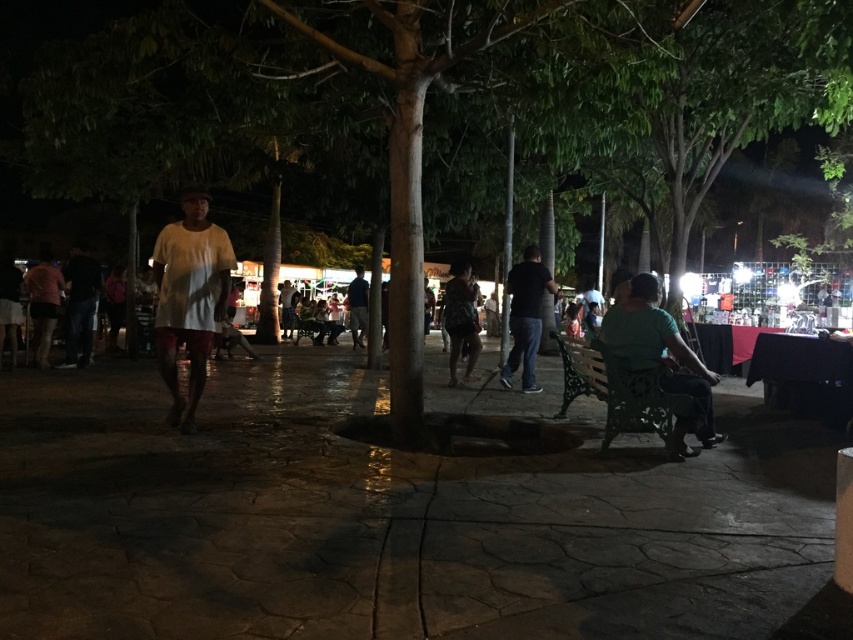
You are standing at the point marked as point (521, 365) in the image. You want to walk straight towards the nearest tree. How far will you have to walk?

The distance of point (521, 365) from viewer is 9.33 meters. Therefore, you will have to walk 9.33 meters to reach the nearest tree.

You are a photographer trying to capture the scene. You notice the white matte shirt at center and the dark blue jeans at left. Which one should you focus on if you want to capture the larger object in your shot?

The white matte shirt at center is larger in size than the dark blue jeans at left, so you should focus on the white matte shirt at center to capture the larger object.